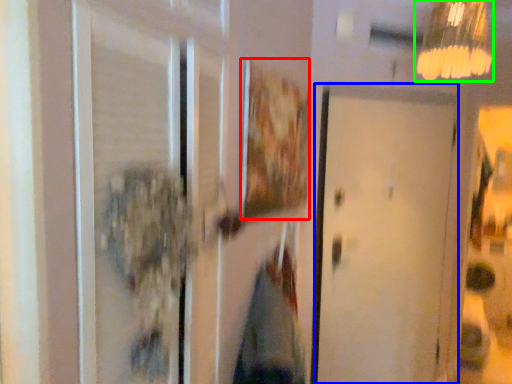
Question: Estimate the real-world distances between objects in this image. Which object is closer to picture frame (highlighted by a red box), door (highlighted by a blue box) or lamp (highlighted by a green box)?

Choices:
 (A) door
 (B) lamp

Answer: (A)